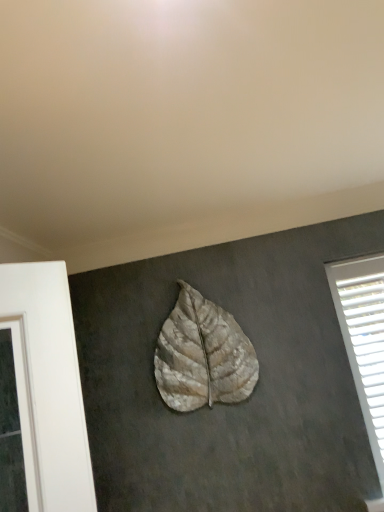
Question: Is textured beige leaf at center in front of or behind white plastic blinds at right in the image?

Choices:
 (A) behind
 (B) front

Answer: (B)

Question: In terms of height, does textured beige leaf at center look taller or shorter compared to white plastic blinds at right?

Choices:
 (A) short
 (B) tall

Answer: (A)

Question: From a real-world perspective, relative to white plastic blinds at right, is textured beige leaf at center vertically above or below?

Choices:
 (A) below
 (B) above

Answer: (B)

Question: Is white plastic blinds at right taller or shorter than textured beige leaf at center?

Choices:
 (A) tall
 (B) short

Answer: (A)

Question: In terms of width, does white plastic blinds at right look wider or thinner when compared to textured beige leaf at center?

Choices:
 (A) wide
 (B) thin

Answer: (B)

Question: Considering the positions of point (382, 330) and point (183, 362), is point (382, 330) closer or farther from the camera than point (183, 362)?

Choices:
 (A) farther
 (B) closer

Answer: (A)

Question: Based on their positions, is white plastic blinds at right located to the left or right of textured beige leaf at center?

Choices:
 (A) right
 (B) left

Answer: (A)